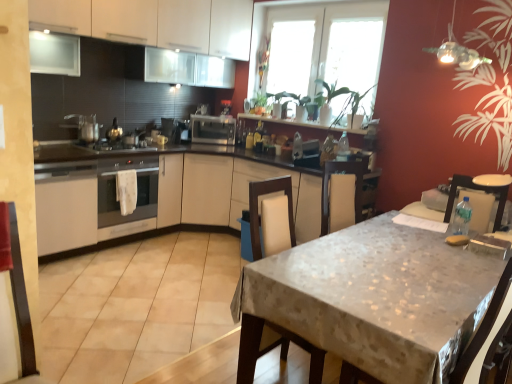
This screenshot has height=384, width=512. What do you see at coordinates (329, 47) in the screenshot? I see `transparent glass window at upper center, which ranks as the first window in right-to-left order` at bounding box center [329, 47].

You are a GUI agent. You are given a task and a screenshot of the screen. Output one action in this format:
    pyautogui.click(x=<x>, y=<y>)
    Task: Click on the transparent glass window at upper center, which is counted as the second window, starting from the left
    This screenshot has width=512, height=384.
    Given the screenshot: What is the action you would take?
    pyautogui.click(x=329, y=47)

What do you see at coordinates (137, 189) in the screenshot?
I see `satin silver oven at center` at bounding box center [137, 189].

Identify the location of satin silver toaster at center, which is counted as the 3th appliance, starting from the front. (213, 129).

Measure the distance between point (293, 64) and camera.

Point (293, 64) is 4.44 meters from camera.

Locate an element on the screen. satin silver oven at center, which appears as the second appliance when viewed from the left is located at coordinates (117, 147).

The width and height of the screenshot is (512, 384). In order to click on textured beige table at center in this screenshot , I will do `click(371, 299)`.

From a real-world perspective, which object stands above the other?

satin silver toaster at center, which ranks as the 1th appliance in left-to-right order, from a real-world perspective.

Does satin silver oven at center have a greater width compared to satin silver toaster at center, the 3th appliance when ordered from right to left?

Yes, satin silver oven at center is wider than satin silver toaster at center, the 3th appliance when ordered from right to left.

Is point (124, 168) farther from viewer compared to point (80, 131)?

No.

Find the location of `the 1st appliance counting from the left side of the transparent glass window at upper center, the second window viewed from the right`. the 1st appliance counting from the left side of the transparent glass window at upper center, the second window viewed from the right is located at coordinates (213, 129).

Could you tell me if satin silver toaster at center, the first appliance viewed from the right, is facing transparent glass window at upper center, acting as the first window starting from the left?

No, satin silver toaster at center, the first appliance viewed from the right, does not turn towards transparent glass window at upper center, acting as the first window starting from the left.

Visually, is satin silver toaster at center, which is counted as the 3th appliance, starting from the front, positioned to the left or to the right of transparent glass window at upper center, acting as the first window starting from the left?

satin silver toaster at center, which is counted as the 3th appliance, starting from the front, is positioned on transparent glass window at upper center, acting as the first window starting from the left,'s left side.

Would you say textured beige table at center is outside satin silver oven at center, arranged as the second appliance when viewed from the right?

Yes.

Looking at this image, in terms of height, does textured beige table at center look taller or shorter compared to satin silver oven at center, arranged as the second appliance when viewed from the right?

Considering their sizes, textured beige table at center has more height than satin silver oven at center, arranged as the second appliance when viewed from the right.

In terms of size, does textured beige table at center appear bigger or smaller than satin silver oven at center, which appears as the second appliance when viewed from the left?

Considering their sizes, textured beige table at center takes up more space than satin silver oven at center, which appears as the second appliance when viewed from the left.

Consider the image. Which of these two, white fabric swivel chair at right, the 2th swivel chair when ordered from left to right, or transparent glass window at upper center, which ranks as the first window in right-to-left order, stands shorter?

Standing shorter between the two is white fabric swivel chair at right, the 2th swivel chair when ordered from left to right.

Does white fabric swivel chair at right, arranged as the first swivel chair when viewed from the right, come behind transparent glass window at upper center, which is counted as the second window, starting from the left?

No, the depth of white fabric swivel chair at right, arranged as the first swivel chair when viewed from the right, is less than that of transparent glass window at upper center, which is counted as the second window, starting from the left.

Considering the points (449, 213) and (365, 73), which point is behind, point (449, 213) or point (365, 73)?

The point (365, 73) is farther from the camera.

Is white fabric swivel chair at right, the 2th swivel chair when ordered from left to right, bigger or smaller than transparent glass window at upper center, which ranks as the first window in right-to-left order?

In the image, white fabric swivel chair at right, the 2th swivel chair when ordered from left to right, appears to be smaller than transparent glass window at upper center, which ranks as the first window in right-to-left order.

Who is shorter, beige fabric swivel chair at lower right, which ranks as the 1th swivel chair in left-to-right order, or satin silver toaster at center, the first appliance when ordered from back to front?

satin silver toaster at center, the first appliance when ordered from back to front.

How far apart are beige fabric swivel chair at lower right, acting as the second swivel chair starting from the right, and satin silver toaster at center, the first appliance viewed from the right?

beige fabric swivel chair at lower right, acting as the second swivel chair starting from the right, and satin silver toaster at center, the first appliance viewed from the right, are 8.75 feet apart.

Is beige fabric swivel chair at lower right, which ranks as the 1th swivel chair in left-to-right order, oriented away from satin silver toaster at center, marked as the 3th appliance in a left-to-right arrangement?

No, beige fabric swivel chair at lower right, which ranks as the 1th swivel chair in left-to-right order,'s orientation is not away from satin silver toaster at center, marked as the 3th appliance in a left-to-right arrangement.

From a real-world perspective, is satin silver oven at center, arranged as the second appliance when viewed from the right, physically above satin silver toaster at center, marked as the 3th appliance in a left-to-right arrangement?

No, from a real-world perspective, satin silver oven at center, arranged as the second appliance when viewed from the right, is not over satin silver toaster at center, marked as the 3th appliance in a left-to-right arrangement

Is satin silver oven at center, the 3th appliance in the back-to-front sequence, to the left or to the right of satin silver toaster at center, which is counted as the 3th appliance, starting from the front, in the image?

Based on their positions, satin silver oven at center, the 3th appliance in the back-to-front sequence, is located to the left of satin silver toaster at center, which is counted as the 3th appliance, starting from the front.

The image size is (512, 384). What are the coordinates of `appliance that is on the right side of satin silver oven at center, positioned as the 1th appliance in front-to-back order` in the screenshot? It's located at (213, 129).

Is satin silver oven at center, the 3th appliance in the back-to-front sequence, oriented away from satin silver toaster at center, which is counted as the 3th appliance, starting from the front?

satin silver oven at center, the 3th appliance in the back-to-front sequence, does not have its back to satin silver toaster at center, which is counted as the 3th appliance, starting from the front.

Is white fabric swivel chair at right, arranged as the first swivel chair when viewed from the right, turned away from white matte cabinet at upper left, the 2th cabinetry when ordered from bottom to top?

No.

Considering the relative positions of white fabric swivel chair at right, the 2th swivel chair when ordered from left to right, and white matte cabinet at upper left, the 2th cabinetry when ordered from bottom to top, in the image provided, is white fabric swivel chair at right, the 2th swivel chair when ordered from left to right, to the right of white matte cabinet at upper left, the 2th cabinetry when ordered from bottom to top, from the viewer's perspective?

Indeed, white fabric swivel chair at right, the 2th swivel chair when ordered from left to right, is positioned on the right side of white matte cabinet at upper left, the 2th cabinetry when ordered from bottom to top.

Which is behind, point (450, 192) or point (56, 21)?

The point (56, 21) is farther from the camera.

Is the surface of white fabric swivel chair at right, arranged as the first swivel chair when viewed from the right, in direct contact with white matte cabinet at upper left, placed as the 1th cabinetry when sorted from top to bottom?

No, white fabric swivel chair at right, arranged as the first swivel chair when viewed from the right, is not in contact with white matte cabinet at upper left, placed as the 1th cabinetry when sorted from top to bottom.

Identify the location of the 2nd appliance counting from the left side of the satin silver oven at center. (86, 127).

Identify the location of the 1st window in front when counting from the satin silver toaster at center, the first appliance viewed from the right. (290, 56).

Estimate the real-world distances between objects in this image. Which object is closer to satin silver oven at center, positioned as the 1th appliance in front-to-back order, satin silver oven at center or satin silver toaster at center, which ranks as the 1th appliance in left-to-right order?

Based on the image, satin silver toaster at center, which ranks as the 1th appliance in left-to-right order, appears to be nearer to satin silver oven at center, positioned as the 1th appliance in front-to-back order.

From the image, which object appears to be farther from white matte cabinet at left, which appears as the 1th cabinetry when ordered from the bottom, beige fabric swivel chair at lower right, which ranks as the 1th swivel chair in left-to-right order, or satin silver oven at center?

beige fabric swivel chair at lower right, which ranks as the 1th swivel chair in left-to-right order, is positioned further to the anchor white matte cabinet at left, which appears as the 1th cabinetry when ordered from the bottom.

Based on their spatial positions, is white matte cabinet at left, which appears as the 1th cabinetry when ordered from the bottom, or satin silver oven at center closer to transparent glass window at upper center, the second window viewed from the right?

Among the two, satin silver oven at center is located nearer to transparent glass window at upper center, the second window viewed from the right.

Estimate the real-world distances between objects in this image. Which object is closer to transparent glass window at upper center, which is counted as the second window, starting from the left, satin silver oven at center, which appears as the second appliance when viewed from the left, or satin silver toaster at center, marked as the 3th appliance in a left-to-right arrangement?

Among the two, satin silver toaster at center, marked as the 3th appliance in a left-to-right arrangement, is located nearer to transparent glass window at upper center, which is counted as the second window, starting from the left.

Based on their spatial positions, is satin silver oven at center or white matte cabinet at left, which appears as the 1th cabinetry when ordered from the bottom, closer to transparent glass window at upper center, which is counted as the second window, starting from the left?

satin silver oven at center is closer to transparent glass window at upper center, which is counted as the second window, starting from the left.

Which object lies further to the anchor point white matte cabinet at upper left, the 2th cabinetry when ordered from bottom to top, white fabric swivel chair at right, the 2th swivel chair when ordered from left to right, or beige fabric swivel chair at lower right, which ranks as the 1th swivel chair in left-to-right order?

The object further to white matte cabinet at upper left, the 2th cabinetry when ordered from bottom to top, is beige fabric swivel chair at lower right, which ranks as the 1th swivel chair in left-to-right order.

Based on their spatial positions, is satin silver toaster at center, which is the second appliance from front to back, or satin silver oven at center further from textured beige table at center?

Among the two, satin silver toaster at center, which is the second appliance from front to back, is located further to textured beige table at center.

From the image, which object appears to be farther from transparent glass window at upper center, which is counted as the second window, starting from the left, white matte cabinet at upper left, the 2th cabinetry when ordered from bottom to top, or satin silver oven at center?

satin silver oven at center.

I want to click on kitchen appliance between white matte cabinet at left, the second cabinetry when ordered from top to bottom, and satin silver toaster at center, the first appliance when ordered from back to front, in the front-back direction, so click(137, 189).

What are the coordinates of `appliance situated between satin silver oven at center and transparent glass window at upper center, which is counted as the second window, starting from the left, from left to right` in the screenshot? It's located at (213, 129).

In order to click on cabinetry between satin silver toaster at center, the second appliance in the back-to-front sequence, and transparent glass window at upper center, which is counted as the second window, starting from the left, in the horizontal direction in this screenshot , I will do `click(154, 23)`.

Where is `cabinetry between white matte cabinet at upper left, the 2th cabinetry when ordered from bottom to top, and beige fabric swivel chair at lower right, which ranks as the 1th swivel chair in left-to-right order, from top to bottom`? Image resolution: width=512 pixels, height=384 pixels. cabinetry between white matte cabinet at upper left, the 2th cabinetry when ordered from bottom to top, and beige fabric swivel chair at lower right, which ranks as the 1th swivel chair in left-to-right order, from top to bottom is located at coordinates click(66, 206).